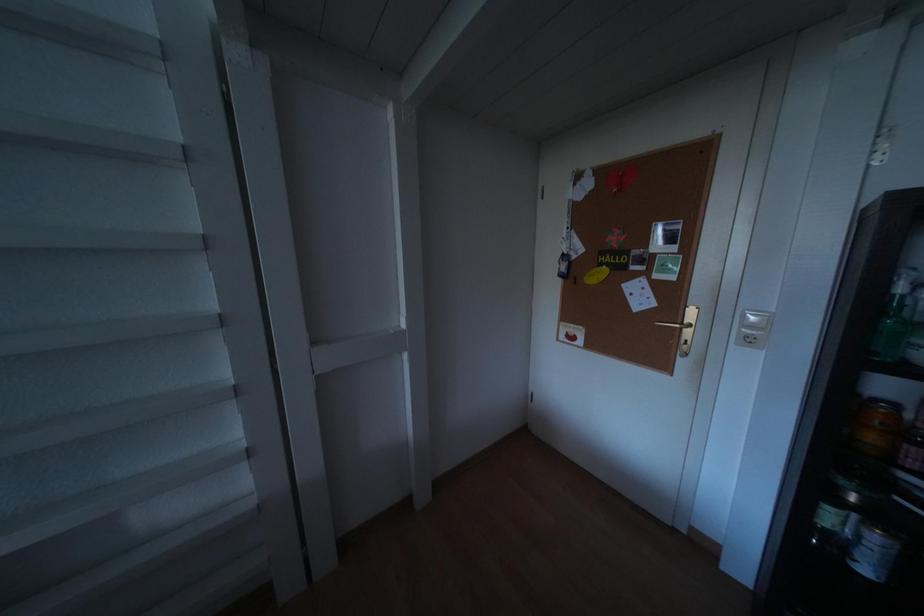
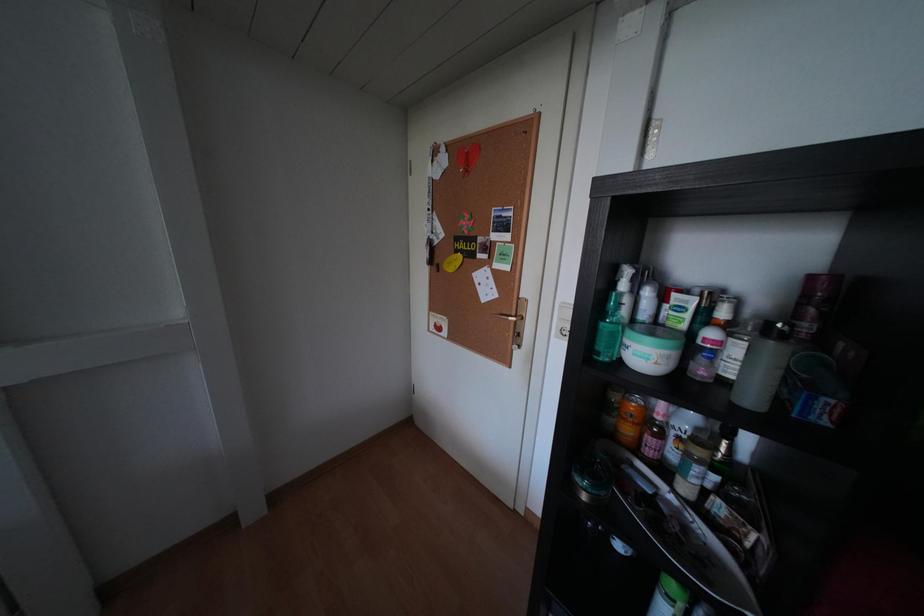
Question: What movement of the cameraman would produce the second image?

Choices:
 (A) Left
 (B) Right
 (C) Forward
 (D) Backward

Answer: (B)